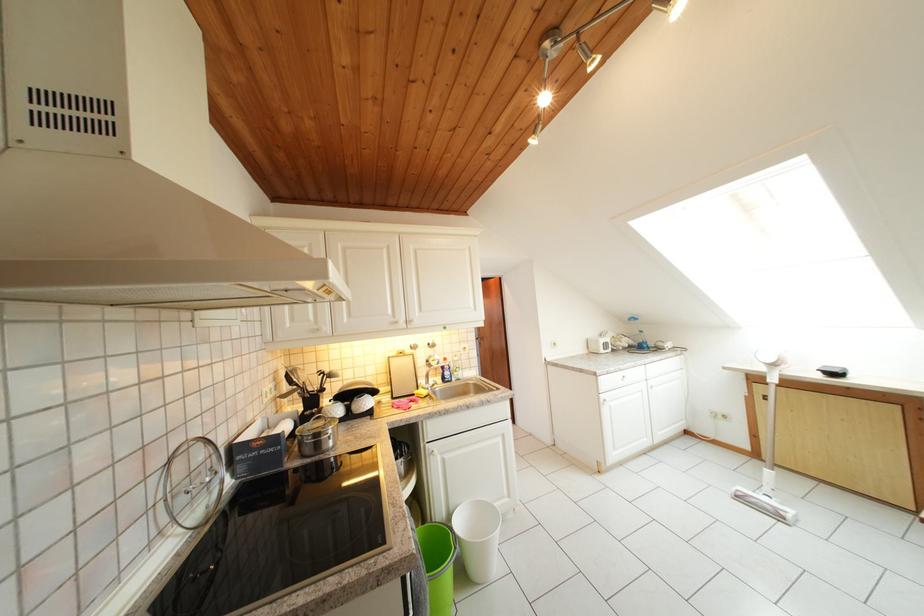
Find where to pull the white cabinet handle. Please return your answer as a coordinate pair (x, y).

(402, 322)